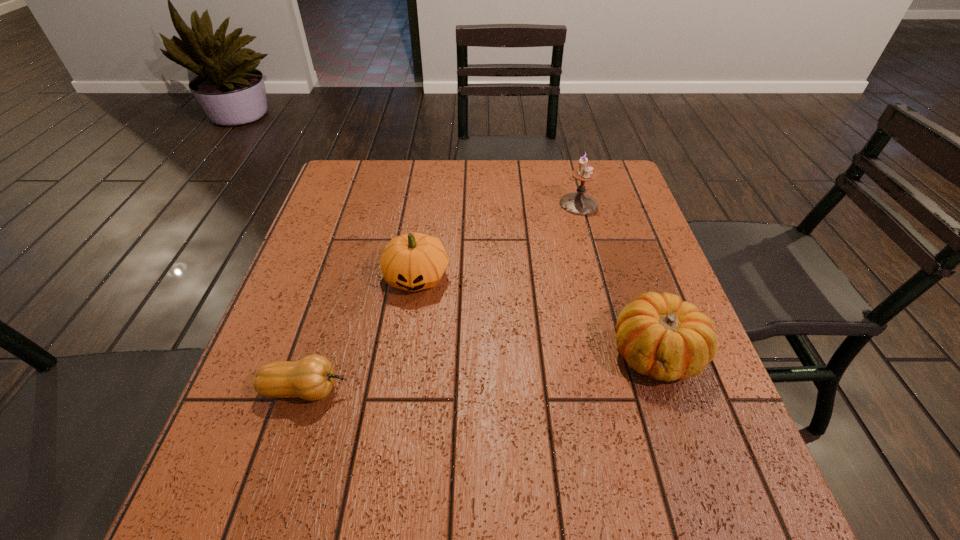
This screenshot has height=540, width=960. Identify the location of the farthest object. pos(578,203).

You are a GUI agent. You are given a task and a screenshot of the screen. Output one action in this format:
    pyautogui.click(x=<x>, y=<y>)
    Task: Click on the tallest object
    
    Given the screenshot: What is the action you would take?
    pyautogui.click(x=578, y=203)

This screenshot has height=540, width=960. I want to click on the second object from left to right, so click(414, 261).

Locate an element on the screen. The height and width of the screenshot is (540, 960). the second gourd from right to left is located at coordinates (414, 261).

Identify the location of the rightmost gourd. (659, 335).

At what (x,y) coordinates should I click in order to perform the action: click on the shortest gourd. Please return your answer as a coordinate pair (x, y). The image size is (960, 540). Looking at the image, I should click on (311, 378).

This screenshot has height=540, width=960. I want to click on the leftmost gourd, so click(311, 378).

The height and width of the screenshot is (540, 960). What are the coordinates of `blank area located 0.110m on the back of the tallest object` in the screenshot? It's located at (570, 173).

Identify the location of blank area located 0.290m on the side of the third object from right to left with the carved face. (396, 420).

Locate an element on the screen. The height and width of the screenshot is (540, 960). vacant space situated on the left of the rightmost gourd is located at coordinates (490, 353).